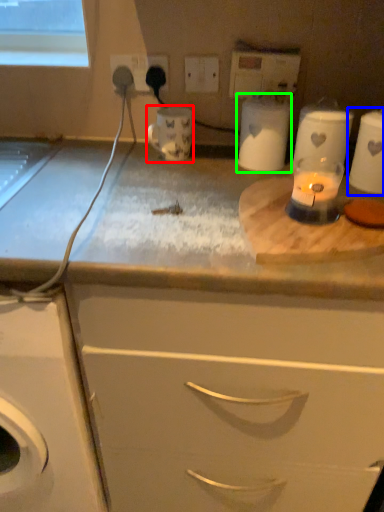
Question: Considering the real-world distances, which object is farthest from appliance (highlighted by a red box)? appliance (highlighted by a blue box) or appliance (highlighted by a green box)?

Choices:
 (A) appliance
 (B) appliance

Answer: (A)